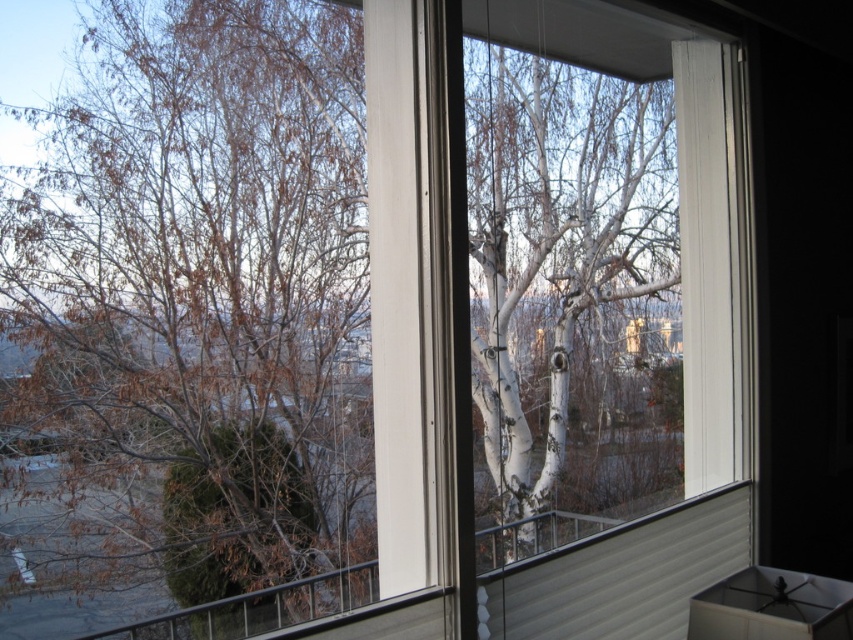
Question: Can you confirm if brown/dried bark tree at left is positioned to the right of white bark tree at center?

Choices:
 (A) no
 (B) yes

Answer: (A)

Question: Which object is farther from the camera taking this photo?

Choices:
 (A) brown/dried bark tree at left
 (B) white bark tree at center

Answer: (B)

Question: Does brown/dried bark tree at left have a smaller size compared to white bark tree at center?

Choices:
 (A) no
 (B) yes

Answer: (B)

Question: Can you confirm if brown/dried bark tree at left is positioned to the right of white bark tree at center?

Choices:
 (A) no
 (B) yes

Answer: (A)